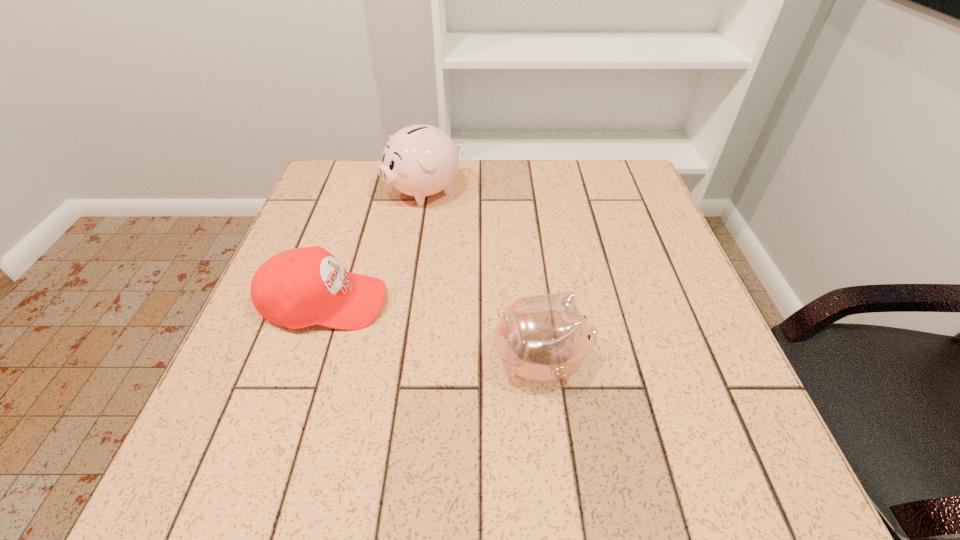
What are the coordinates of `vacant space in between the rightmost object and the left piggy bank` in the screenshot? It's located at (483, 277).

Where is `free spot between the baseball cap and the right piggy bank`? This screenshot has width=960, height=540. free spot between the baseball cap and the right piggy bank is located at coordinates (433, 333).

Find the location of `empty space between the shortest object and the tallest object`. empty space between the shortest object and the tallest object is located at coordinates (375, 247).

Identify the location of free space between the nearer piggy bank and the tallest object. This screenshot has width=960, height=540. (483, 277).

This screenshot has height=540, width=960. What are the coordinates of `free point between the shortest object and the nearer piggy bank` in the screenshot? It's located at (433, 333).

Where is `empty space between the baseball cap and the farthest object`? empty space between the baseball cap and the farthest object is located at coordinates (375, 247).

In order to click on the closest object to the farthest object in this screenshot , I will do `click(300, 287)`.

Where is `the closest object to the nearer piggy bank`? the closest object to the nearer piggy bank is located at coordinates (300, 287).

This screenshot has width=960, height=540. Find the location of `vacant space that satisfies the following two spatial constraints: 1. on the front side of the left piggy bank; 2. on the front panel of the baseball cap`. vacant space that satisfies the following two spatial constraints: 1. on the front side of the left piggy bank; 2. on the front panel of the baseball cap is located at coordinates (407, 303).

What are the coordinates of `free region that satisfies the following two spatial constraints: 1. on the front side of the taller piggy bank; 2. on the front panel of the shortest object` in the screenshot? It's located at (407, 303).